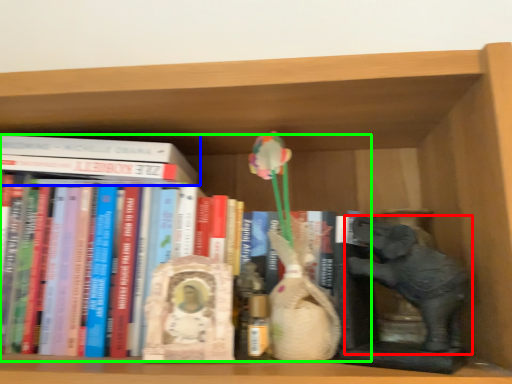
Question: Which object is the closest to the elephant (highlighted by a red box)? Choose among these: book (highlighted by a blue box) or book (highlighted by a green box).

Choices:
 (A) book
 (B) book

Answer: (B)